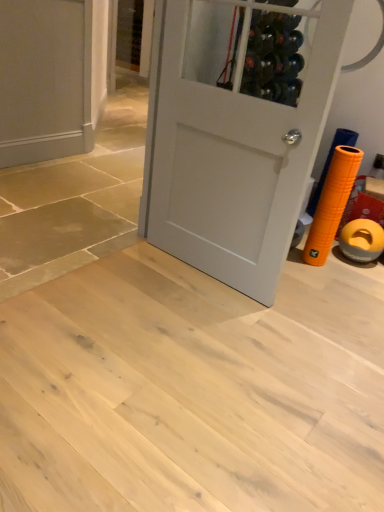
At what (x,y) coordinates should I click in order to perform the action: click on free space to the left of white matte door at center, the 2th door when ordered from left to right. Please return your answer as a coordinate pair (x, y). Image resolution: width=384 pixels, height=512 pixels. Looking at the image, I should click on (136, 278).